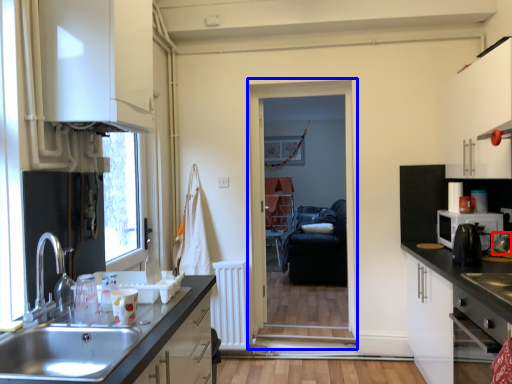
Question: Which object is closer to the camera taking this photo, appliance (highlighted by a red box) or screen door (highlighted by a blue box)?

Choices:
 (A) appliance
 (B) screen door

Answer: (A)